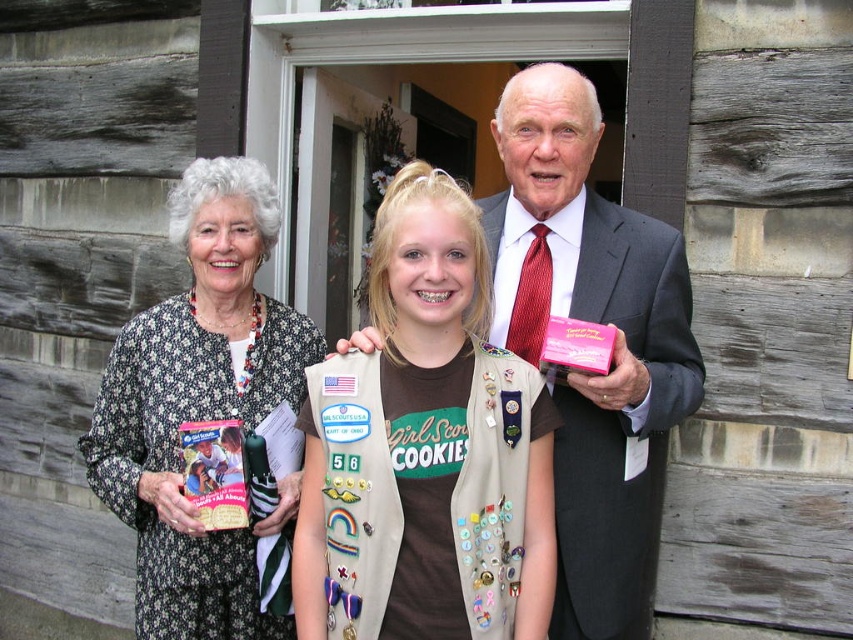
Question: Can you confirm if tan girl scout vest at center is positioned above floral-patterned dress at left?

Choices:
 (A) no
 (B) yes

Answer: (A)

Question: Observing the image, what is the correct spatial positioning of dark gray suit at center in reference to floral-patterned dress at left?

Choices:
 (A) below
 (B) above

Answer: (B)

Question: Does tan girl scout vest at center have a larger size compared to floral-patterned dress at left?

Choices:
 (A) yes
 (B) no

Answer: (B)

Question: Which point is closer to the camera?

Choices:
 (A) (190, 259)
 (B) (418, 228)

Answer: (B)

Question: Which of the following is the closest to the observer?

Choices:
 (A) floral-patterned dress at left
 (B) tan girl scout vest at center
 (C) dark gray suit at center

Answer: (B)

Question: Which of the following is the farthest from the observer?

Choices:
 (A) click(151, 339)
 (B) click(547, 202)

Answer: (A)